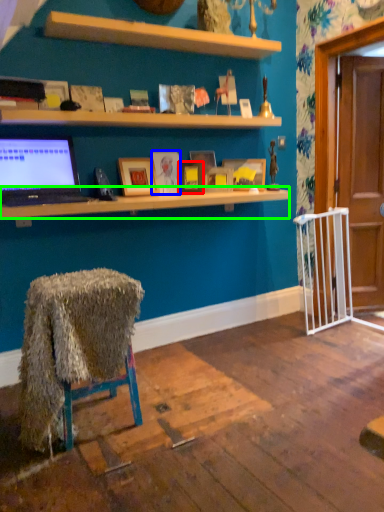
Question: Which object is the closest to the picture frame (highlighted by a red box)? Choose among these: picture frame (highlighted by a blue box) or desk (highlighted by a green box).

Choices:
 (A) picture frame
 (B) desk

Answer: (A)